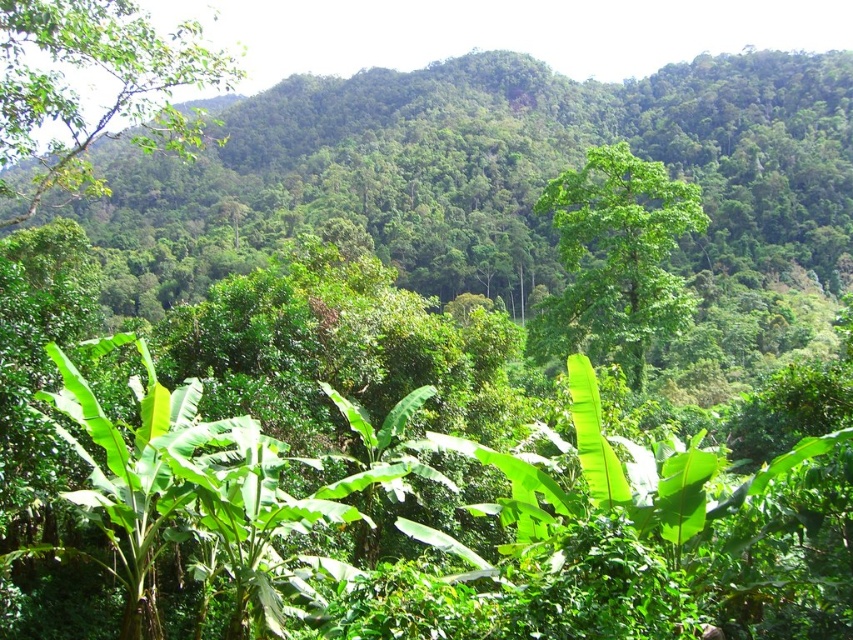
Question: Is green leafy tree at upper left behind green leafy tree at center?

Choices:
 (A) no
 (B) yes

Answer: (A)

Question: Can you confirm if green leafy tree at upper left is positioned below green leafy tree at center?

Choices:
 (A) yes
 (B) no

Answer: (B)

Question: Which of these objects is positioned farthest from the green leafy tree at center?

Choices:
 (A) green leafy tree at upper left
 (B) green leafy banana tree at center

Answer: (A)

Question: Which object is positioned closest to the green leafy tree at upper left?

Choices:
 (A) green leafy banana tree at center
 (B) green leafy tree at center

Answer: (A)

Question: Which object is positioned farthest from the green leafy tree at center?

Choices:
 (A) green leafy tree at upper left
 (B) green leafy banana tree at center

Answer: (A)

Question: Is green leafy tree at upper left above green leafy tree at center?

Choices:
 (A) no
 (B) yes

Answer: (B)